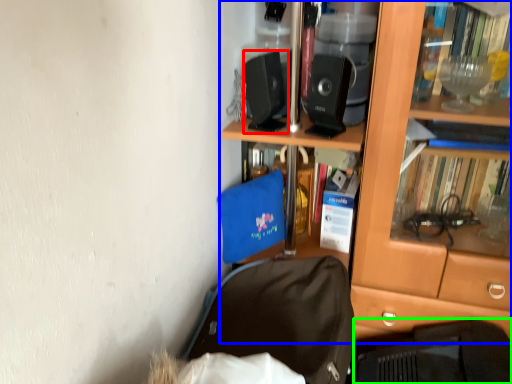
Question: Estimate the real-world distances between objects in this image. Which object is closer to loudspeaker (highlighted by a red box), bookcase (highlighted by a blue box) or laptop (highlighted by a green box)?

Choices:
 (A) bookcase
 (B) laptop

Answer: (A)